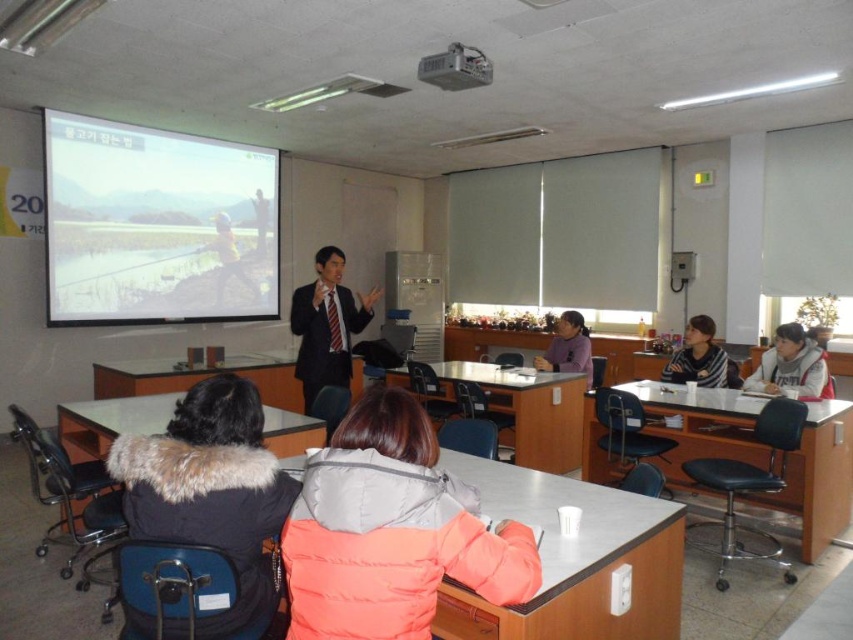
Question: Which object is farther from the camera taking this photo?

Choices:
 (A) orange puffer jacket at lower center
 (B) metallic projector at upper center

Answer: (B)

Question: Which point is farther to the camera?

Choices:
 (A) metallic projector at upper center
 (B) dark suit at center

Answer: (B)

Question: Is orange puffer jacket at lower center to the left of white glossy table at lower left from the viewer's perspective?

Choices:
 (A) no
 (B) yes

Answer: (A)

Question: Does white glossy table at center appear over white fleece jacket at lower right?

Choices:
 (A) yes
 (B) no

Answer: (B)

Question: Which object is closer to the camera taking this photo?

Choices:
 (A) orange puffer jacket at lower center
 (B) white fleece jacket at lower right
 (C) yellow fabric jacket at center
 (D) purple fleece jacket at center

Answer: (A)

Question: Is smooth black table at lower right bigger than dark suit at center?

Choices:
 (A) no
 (B) yes

Answer: (B)